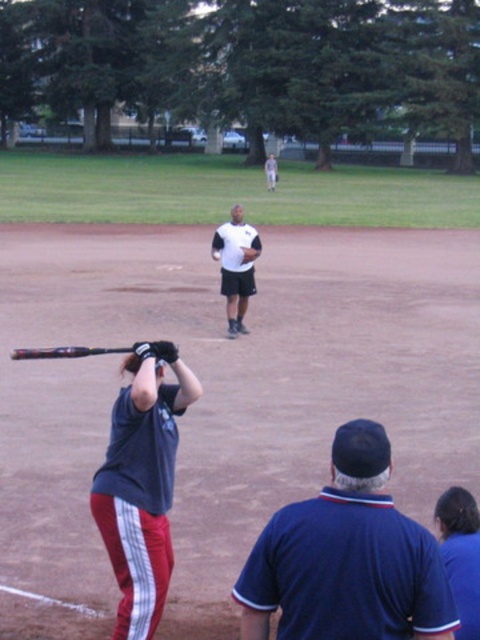
Question: Can you confirm if dark blue fabric cap at upper center is positioned to the right of shiny metallic bat at lower left?

Choices:
 (A) yes
 (B) no

Answer: (A)

Question: Which point is farther to the camera?

Choices:
 (A) (33, 358)
 (B) (233, 211)

Answer: (B)

Question: Which of the following is the closest to the observer?

Choices:
 (A) (32, 355)
 (B) (231, 337)
 (C) (116, 468)

Answer: (A)

Question: Which point appears closest to the camera in this image?

Choices:
 (A) (80, 349)
 (B) (453, 595)
 (C) (367, 496)
 (D) (123, 508)

Answer: (C)

Question: Can you confirm if blue jersey at center is positioned below white matte jersey at center?

Choices:
 (A) yes
 (B) no

Answer: (A)

Question: Is the position of dark blue fabric cap at upper center less distant than that of white matte jersey at center?

Choices:
 (A) no
 (B) yes

Answer: (B)